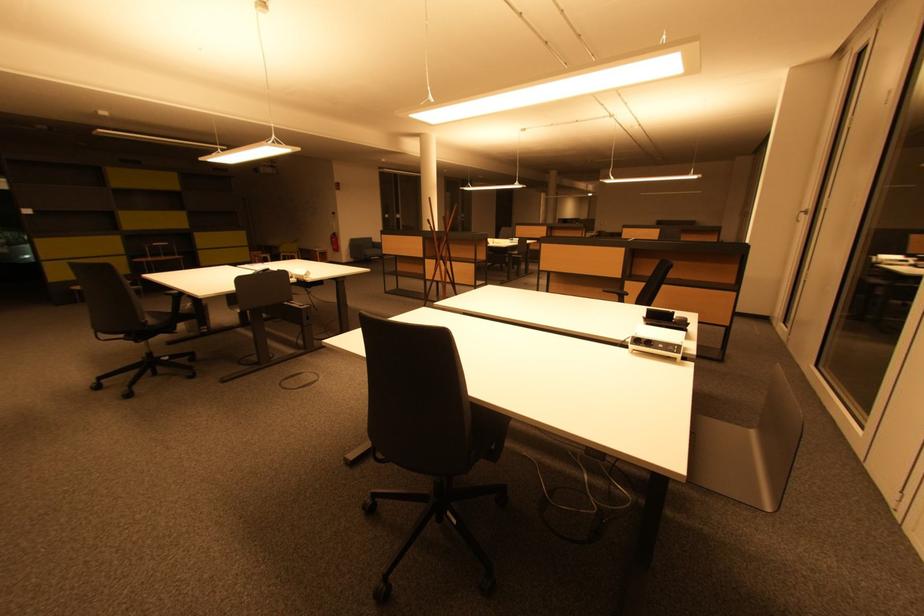
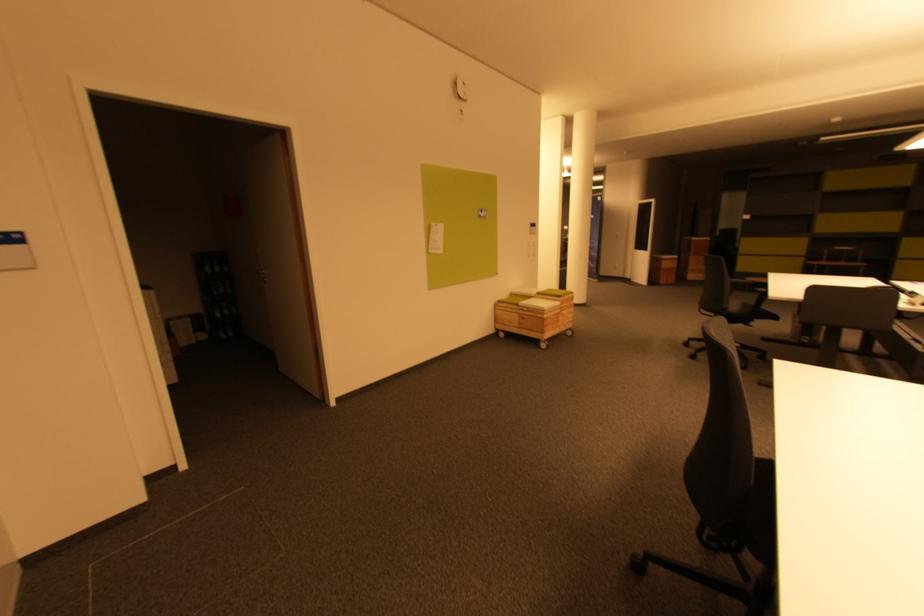
First-person continuous shooting, in which direction is the camera rotating?

The rotation direction of the camera is left-down.